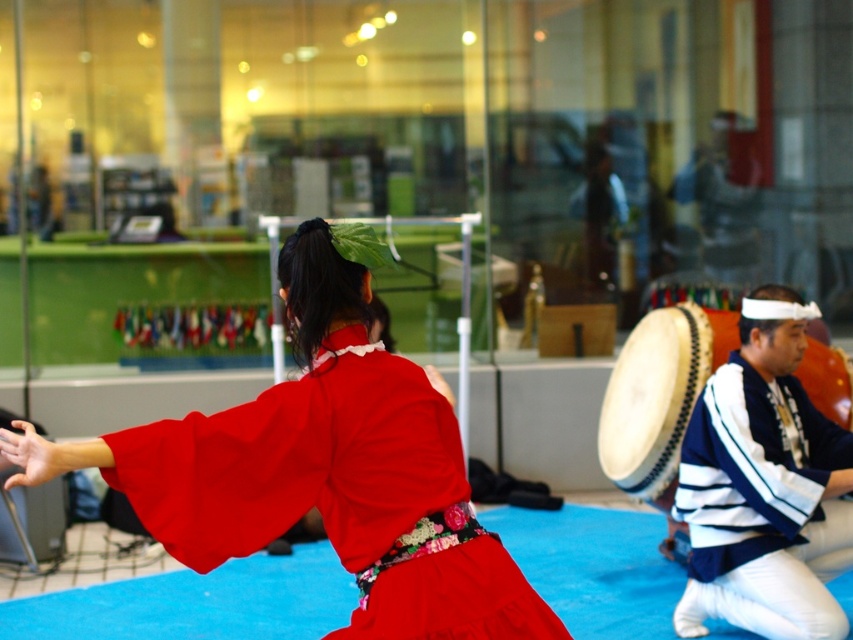
Is matte red kimono at center closer to the viewer compared to white striped shirt at right?

That is True.

Who is more distant from viewer, (x=332, y=468) or (x=772, y=608)?

Point (x=772, y=608)

The height and width of the screenshot is (640, 853). Find the location of `matte red kimono at center`. matte red kimono at center is located at coordinates (323, 470).

Which is above, white striped shirt at right or white textured drum at right?

Positioned higher is white textured drum at right.

The width and height of the screenshot is (853, 640). Describe the element at coordinates (764, 486) in the screenshot. I see `white striped shirt at right` at that location.

Is point (764, 442) less distant than point (735, 314)?

Yes.

Identify the location of white striped shirt at right. The width and height of the screenshot is (853, 640). (764, 486).

Does matte red kimono at center have a larger size compared to white textured drum at right?

Correct, matte red kimono at center is larger in size than white textured drum at right.

Where is `matte red kimono at center`? matte red kimono at center is located at coordinates (323, 470).

Locate an element on the screen. Image resolution: width=853 pixels, height=640 pixels. matte red kimono at center is located at coordinates (323, 470).